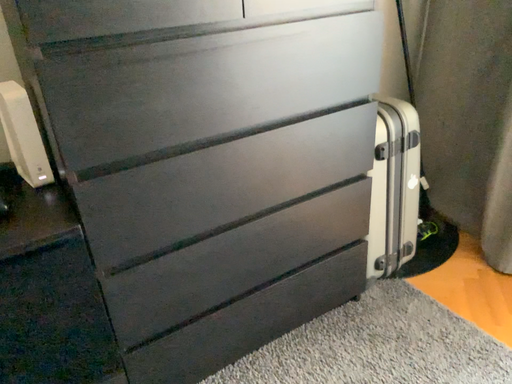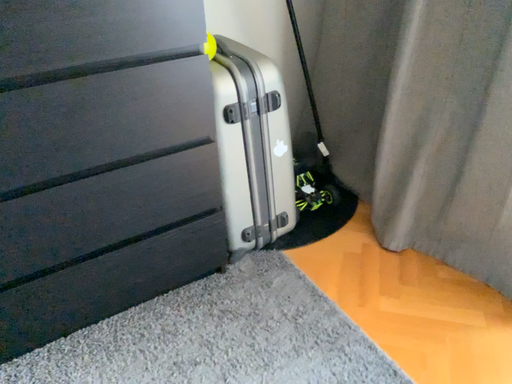
Question: Which way did the camera rotate in the video?

Choices:
 (A) rotated upward
 (B) rotated downward

Answer: (B)